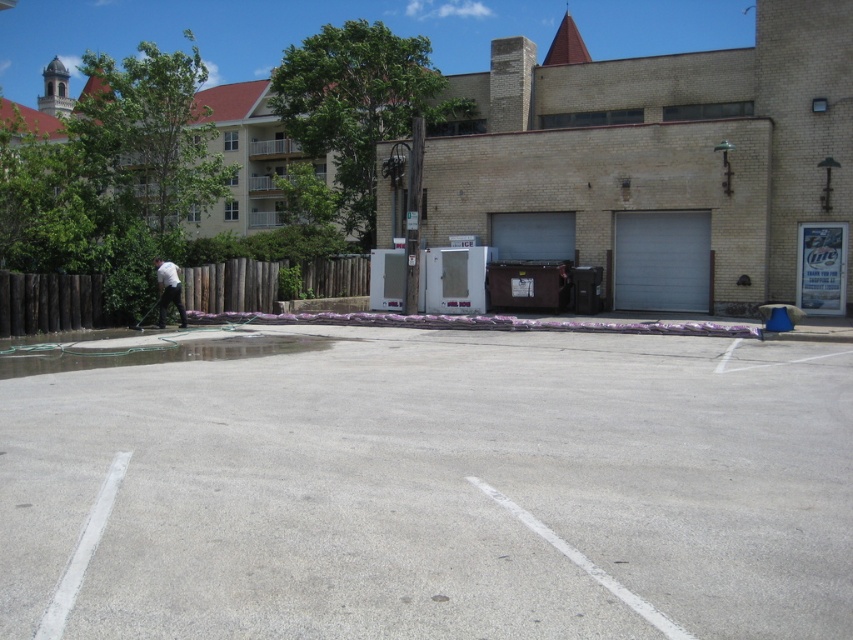
Question: Among these points, which one is farthest from the camera?

Choices:
 (A) (177, 289)
 (B) (712, 576)

Answer: (A)

Question: Can you confirm if gray concrete parking lot at center is wider than white matte shirt at left?

Choices:
 (A) no
 (B) yes

Answer: (B)

Question: Is clear concrete puddle at lower left to the right of white matte shirt at left from the viewer's perspective?

Choices:
 (A) yes
 (B) no

Answer: (A)

Question: Among these points, which one is farthest from the camera?

Choices:
 (A) (1, 282)
 (B) (753, 394)
 (C) (166, 305)

Answer: (C)

Question: Which is nearer to the white matte shirt at left?

Choices:
 (A) clear concrete puddle at lower left
 (B) gray concrete parking lot at center
 (C) brown wooden fence at left

Answer: (C)

Question: Does clear concrete puddle at lower left appear on the right side of white matte shirt at left?

Choices:
 (A) yes
 (B) no

Answer: (A)